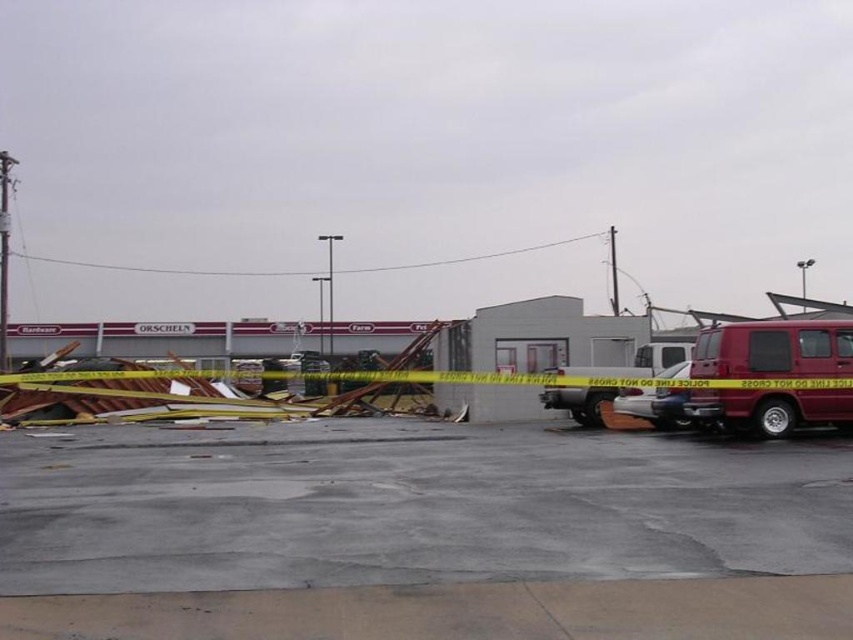
You are a delivery driver who needs to park your matte red van at right near the gray concrete pavement at center. Is there enough space to park the van without blocking the pavement?

The gray concrete pavement at center is positioned under matte red van at right, so parking the matte red van at right directly over the gray concrete pavement at center would block it. Choose another parking spot to avoid obstruction.

You are a delivery driver who needs to park your vehicle in this area. You have two options for parking spots near the matte red van at right and the metallic silver van at center. Considering their sizes, which van would require a larger parking space?

The matte red van at right is larger in size than the metallic silver van at center, so it would require a larger parking space.

You are a delivery driver who needs to park your vehicle in the parking lot shown in the image. You see the matte red van at right and the metallic silver van at center. Which van is positioned farther to the right side of the parking lot?

The matte red van at right is positioned farther to the right side of the parking lot than the metallic silver van at center.